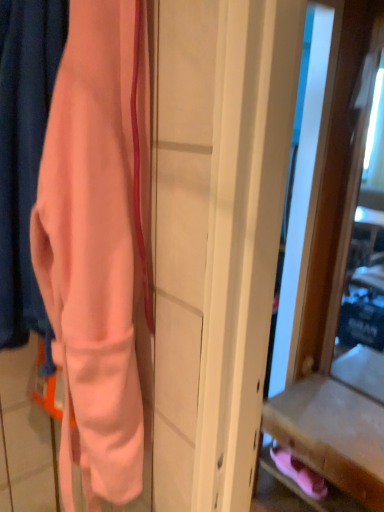
Question: Considering the relative positions of matte peach fabric at left and pink suede shoes at lower right in the image provided, is matte peach fabric at left to the right of pink suede shoes at lower right from the viewer's perspective?

Choices:
 (A) yes
 (B) no

Answer: (B)

Question: Does matte peach fabric at left have a greater height compared to pink suede shoes at lower right?

Choices:
 (A) no
 (B) yes

Answer: (B)

Question: Is matte peach fabric at left next to pink suede shoes at lower right and touching it?

Choices:
 (A) yes
 (B) no

Answer: (B)

Question: Considering the relative positions of matte peach fabric at left and pink suede shoes at lower right in the image provided, is matte peach fabric at left behind pink suede shoes at lower right?

Choices:
 (A) no
 (B) yes

Answer: (A)

Question: From a real-world perspective, is matte peach fabric at left positioned under pink suede shoes at lower right based on gravity?

Choices:
 (A) no
 (B) yes

Answer: (A)

Question: Considering the positions of pink suede shoes at lower right and wooden drawer at lower right in the image, is pink suede shoes at lower right bigger or smaller than wooden drawer at lower right?

Choices:
 (A) big
 (B) small

Answer: (B)

Question: Is pink suede shoes at lower right wider or thinner than wooden drawer at lower right?

Choices:
 (A) thin
 (B) wide

Answer: (A)

Question: From the image's perspective, is pink suede shoes at lower right located above or below wooden drawer at lower right?

Choices:
 (A) above
 (B) below

Answer: (A)

Question: Do you think pink suede shoes at lower right is within wooden drawer at lower right, or outside of it?

Choices:
 (A) outside
 (B) inside

Answer: (B)

Question: From a real-world perspective, relative to wooden drawer at lower right, is matte peach fabric at left vertically above or below?

Choices:
 (A) above
 (B) below

Answer: (A)

Question: Looking at their shapes, would you say matte peach fabric at left is wider or thinner than wooden drawer at lower right?

Choices:
 (A) thin
 (B) wide

Answer: (A)

Question: Relative to wooden drawer at lower right, is matte peach fabric at left in front or behind?

Choices:
 (A) behind
 (B) front

Answer: (B)

Question: Is matte peach fabric at left taller or shorter than wooden drawer at lower right?

Choices:
 (A) short
 (B) tall

Answer: (B)

Question: Looking at their shapes, would you say pink suede shoes at lower right is wider or thinner than matte peach fabric at left?

Choices:
 (A) thin
 (B) wide

Answer: (A)

Question: From the image's perspective, is pink suede shoes at lower right located above or below matte peach fabric at left?

Choices:
 (A) below
 (B) above

Answer: (A)